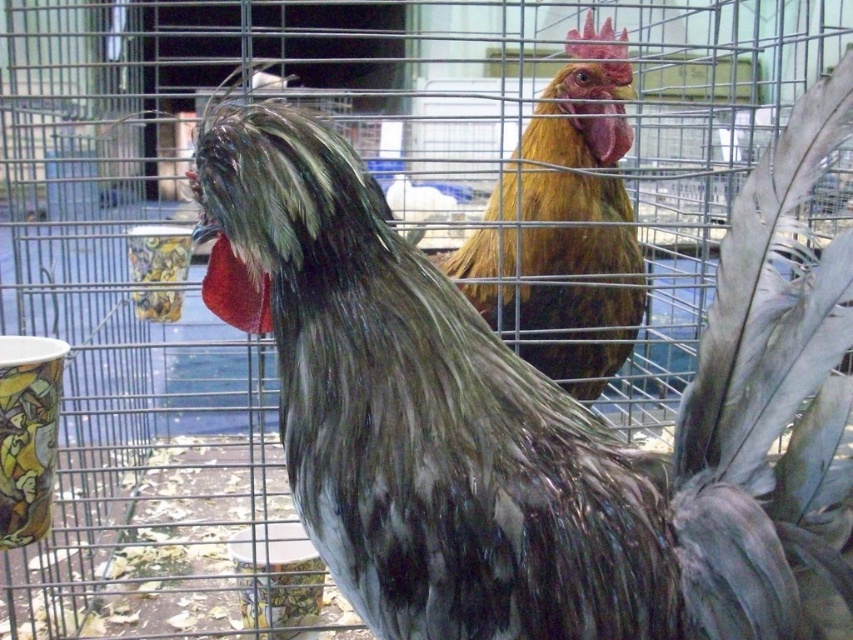
You are a farmer checking the cage. There are two points marked in the cage. The first point is at coordinates point (691, 470) and the second point is at point (612, 51). Which point is nearer to you as you look into the cage?

Point (691, 470) is closer to the camera than point (612, 51), so the first point is nearer to you as you look into the cage.